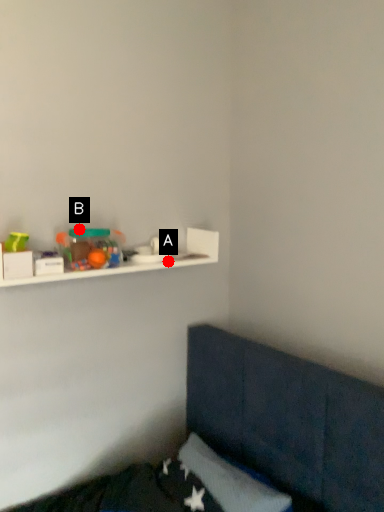
Question: Two points are circled on the image, labeled by A and B beside each circle. Which point is closer to the camera taking this photo?

Choices:
 (A) A is closer
 (B) B is closer

Answer: (B)